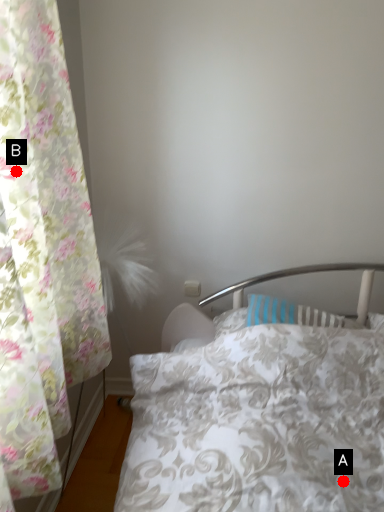
Question: Two points are circled on the image, labeled by A and B beside each circle. Which point is closer to the camera?

Choices:
 (A) A is closer
 (B) B is closer

Answer: (B)